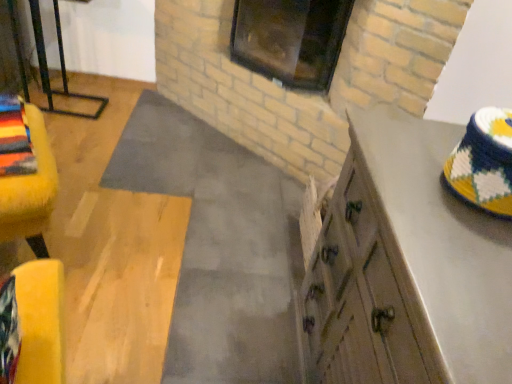
What do you see at coordinates (30, 189) in the screenshot?
I see `yellow fuzzy ottoman at left` at bounding box center [30, 189].

Where is `dark glass window at upper center`? This screenshot has height=384, width=512. dark glass window at upper center is located at coordinates (290, 40).

The image size is (512, 384). Find the location of `wooden cabinet at right`. wooden cabinet at right is located at coordinates (406, 267).

Considering the sizes of yellow fuzzy ottoman at left and wooden cabinet at right in the image, is yellow fuzzy ottoman at left bigger or smaller than wooden cabinet at right?

Clearly, yellow fuzzy ottoman at left is smaller in size than wooden cabinet at right.

Is yellow fuzzy ottoman at left situated inside wooden cabinet at right or outside?

yellow fuzzy ottoman at left is located beyond the bounds of wooden cabinet at right.

Locate an element on the screen. furniture behind the wooden cabinet at right is located at coordinates (30, 189).

Is wooden cabinet at right wider or thinner than dark glass window at upper center?

Considering their sizes, wooden cabinet at right looks broader than dark glass window at upper center.

Is wooden cabinet at right looking in the opposite direction of dark glass window at upper center?

No, wooden cabinet at right is not facing away from dark glass window at upper center.

In the image, is wooden cabinet at right positioned in front of or behind dark glass window at upper center?

wooden cabinet at right is positioned closer to the viewer than dark glass window at upper center.

Which of these two, wooden cabinet at right or dark glass window at upper center, is bigger?

With larger size is wooden cabinet at right.

Identify the location of furniture on the left of wooden cabinet at right. Image resolution: width=512 pixels, height=384 pixels. (30, 189).

Would you say wooden cabinet at right is a long distance from yellow fuzzy ottoman at left?

Indeed, wooden cabinet at right is not near yellow fuzzy ottoman at left.

Which of these two, wooden cabinet at right or yellow fuzzy ottoman at left, is bigger?

wooden cabinet at right is bigger.

In the scene shown: Considering the positions of objects wooden cabinet at right and yellow fuzzy ottoman at left in the image provided, who is more to the right, wooden cabinet at right or yellow fuzzy ottoman at left?

wooden cabinet at right is more to the right.

From the image's perspective, is yellow fuzzy ottoman at left above dark glass window at upper center?

Actually, yellow fuzzy ottoman at left appears below dark glass window at upper center in the image.

Is the position of yellow fuzzy ottoman at left more distant than that of dark glass window at upper center?

No, yellow fuzzy ottoman at left is closer to the viewer.

Is point (34, 246) more distant than point (332, 41)?

No, it is not.

Is point (341, 33) behind point (12, 206)?

Yes, point (341, 33) is behind point (12, 206).

Looking at this image, from the image's perspective, is dark glass window at upper center located above yellow fuzzy ottoman at left?

Yes, from the image's perspective, dark glass window at upper center is above yellow fuzzy ottoman at left.

From a real-world perspective, is dark glass window at upper center under yellow fuzzy ottoman at left?

Actually, dark glass window at upper center is physically above yellow fuzzy ottoman at left in the real world.

Is dark glass window at upper center aimed at yellow fuzzy ottoman at left?

Yes, dark glass window at upper center is oriented towards yellow fuzzy ottoman at left.

From a real-world perspective, is dark glass window at upper center located beneath wooden cabinet at right?

No.

Considering the sizes of dark glass window at upper center and wooden cabinet at right in the image, is dark glass window at upper center wider or thinner than wooden cabinet at right?

dark glass window at upper center is thinner than wooden cabinet at right.

Who is more distant, dark glass window at upper center or wooden cabinet at right?

dark glass window at upper center is behind.

Find the location of `cabinetry on the right side of yellow fuzzy ottoman at left`. cabinetry on the right side of yellow fuzzy ottoman at left is located at coordinates (406, 267).

You are a GUI agent. You are given a task and a screenshot of the screen. Output one action in this format:
    pyautogui.click(x=<x>, y=<y>)
    Task: Click on the window located above the wooden cabinet at right (from a real-world perspective)
    Image resolution: width=512 pixels, height=384 pixels.
    Given the screenshot: What is the action you would take?
    pyautogui.click(x=290, y=40)

Which object lies further to the anchor point yellow fuzzy ottoman at left, dark glass window at upper center or wooden cabinet at right?

dark glass window at upper center is further to yellow fuzzy ottoman at left.

Based on their spatial positions, is yellow fuzzy ottoman at left or wooden cabinet at right closer to dark glass window at upper center?

The object closer to dark glass window at upper center is wooden cabinet at right.

Estimate the real-world distances between objects in this image. Which object is closer to yellow fuzzy ottoman at left, wooden cabinet at right or dark glass window at upper center?

wooden cabinet at right.

Considering their positions, is dark glass window at upper center positioned closer to wooden cabinet at right than yellow fuzzy ottoman at left?

The object closer to wooden cabinet at right is yellow fuzzy ottoman at left.

When comparing their distances from wooden cabinet at right, does yellow fuzzy ottoman at left or dark glass window at upper center seem further?

Result: dark glass window at upper center lies further to wooden cabinet at right than the other object.

Looking at the image, which one is located further to dark glass window at upper center, wooden cabinet at right or yellow fuzzy ottoman at left?

yellow fuzzy ottoman at left is positioned further to the anchor dark glass window at upper center.

At what (x,y) coordinates should I click in order to perform the action: click on window between yellow fuzzy ottoman at left and wooden cabinet at right in the horizontal direction. Please return your answer as a coordinate pair (x, y). Looking at the image, I should click on (290, 40).